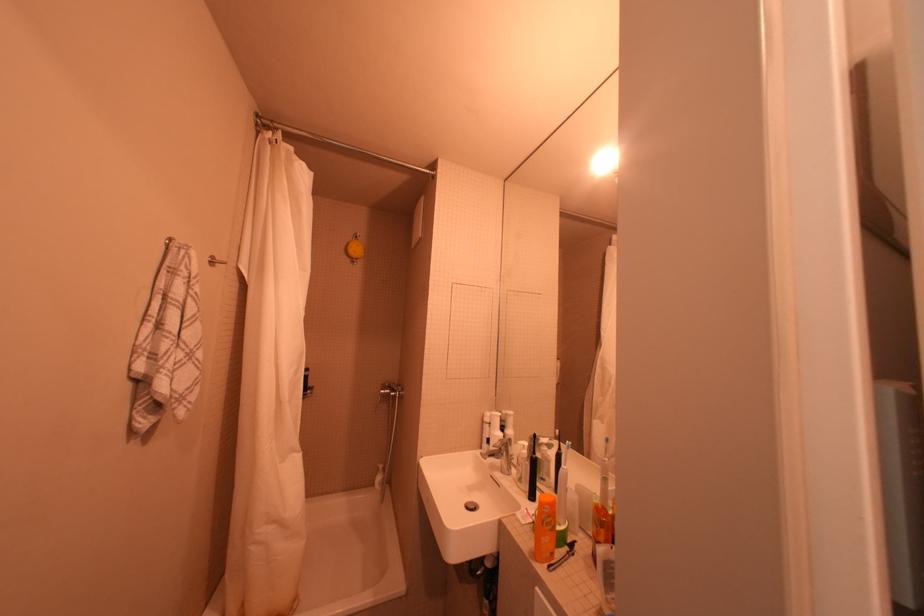
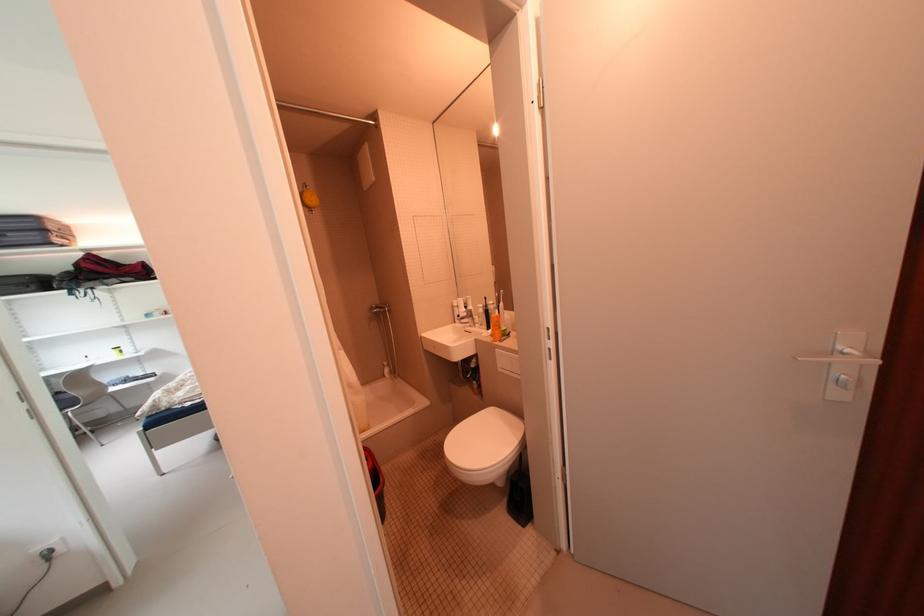
Locate, in the second image, the point that corresponds to point (528, 485) in the first image.

(490, 328)